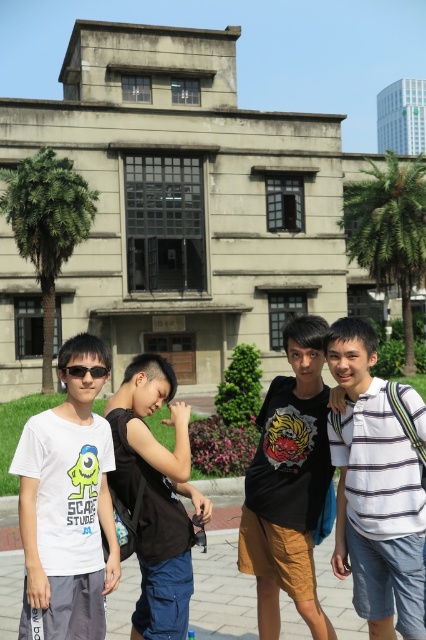
You are a photographer trying to capture a group photo of the four individuals in front of the building. You want to ensure that the black cotton tank top at center is clearly visible in the photo. Where should you position yourself relative to the group to best capture this detail?

To best capture the black cotton tank top at center, position yourself directly in front of the group, aligned with the center where the black cotton tank top at center is located, ensuring it remains central and visible in the frame.